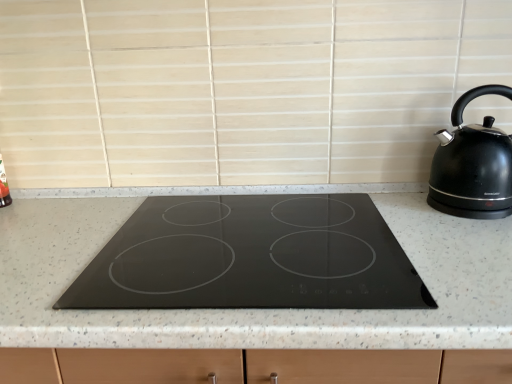
Question: Does point (476, 218) appear closer or farther from the camera than point (416, 344)?

Choices:
 (A) closer
 (B) farther

Answer: (B)

Question: In terms of size, does black glossy kettle at right appear bigger or smaller than black granite countertop at center?

Choices:
 (A) small
 (B) big

Answer: (A)

Question: From the image's perspective, is black glossy kettle at right above or below black granite countertop at center?

Choices:
 (A) above
 (B) below

Answer: (A)

Question: From the image's perspective, relative to black glossy kettle at right, is black granite countertop at center above or below?

Choices:
 (A) above
 (B) below

Answer: (B)

Question: Is black granite countertop at center to the left or to the right of black glossy kettle at right in the image?

Choices:
 (A) left
 (B) right

Answer: (A)

Question: From a real-world perspective, is black granite countertop at center positioned above or below black glossy kettle at right?

Choices:
 (A) below
 (B) above

Answer: (A)

Question: Considering the positions of black granite countertop at center and black glossy kettle at right in the image, is black granite countertop at center taller or shorter than black glossy kettle at right?

Choices:
 (A) tall
 (B) short

Answer: (A)